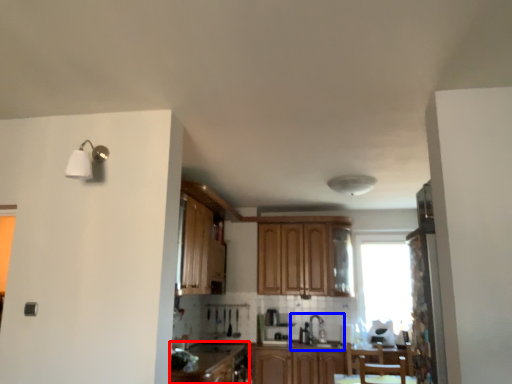
Question: Which of the following is the farthest to the observer, cabinetry (highlighted by a red box) or sink (highlighted by a blue box)?

Choices:
 (A) cabinetry
 (B) sink

Answer: (B)